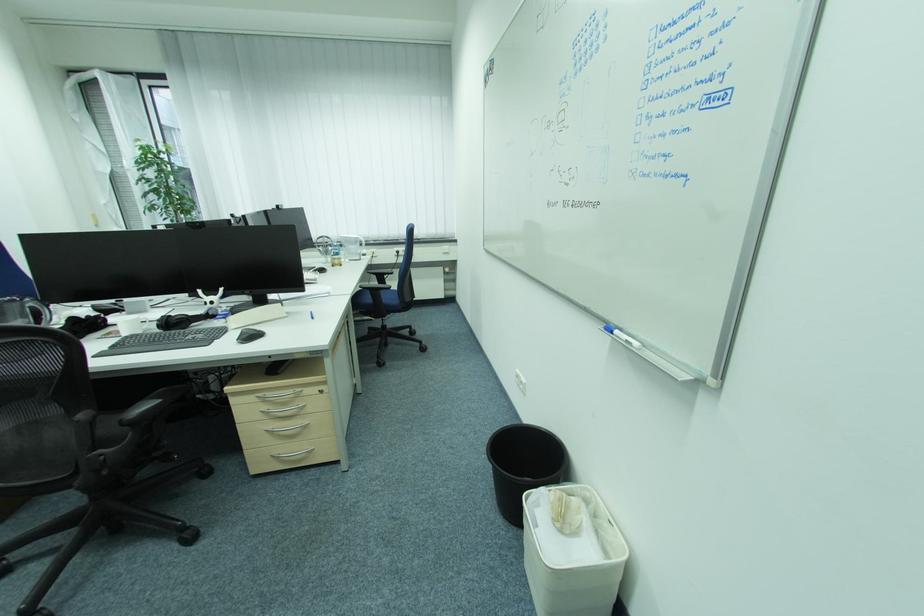
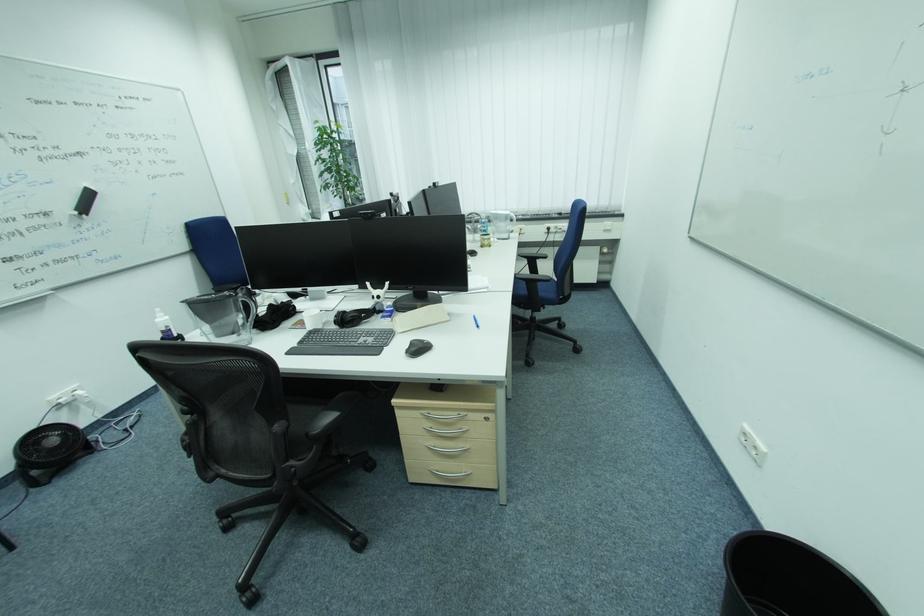
In the second image, find the point that corresponds to pixel 275 411 in the first image.

(438, 429)